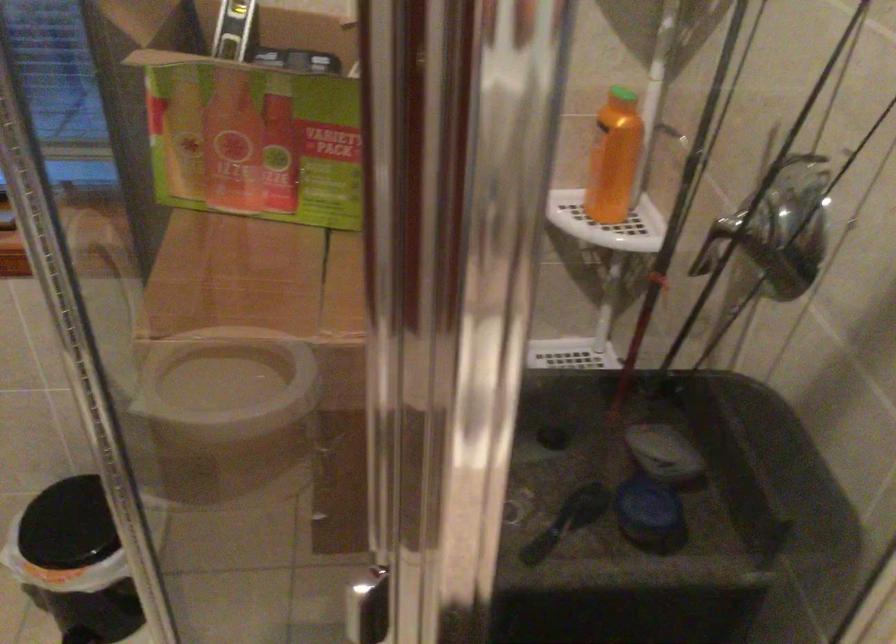
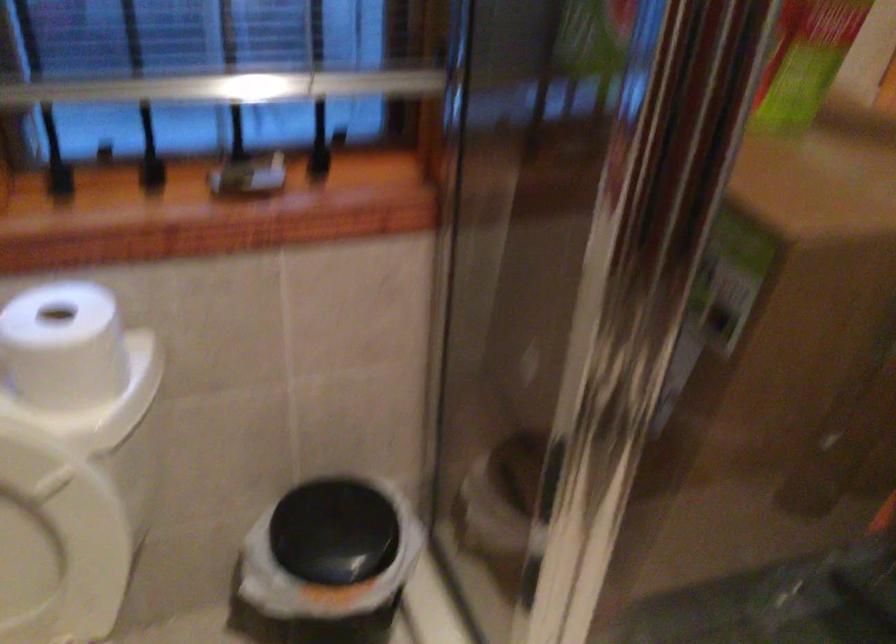
Question: In a continuous first-person perspective shot, in which direction is the camera moving?

Choices:
 (A) Left
 (B) Right
 (C) Forward
 (D) Backward

Answer: (A)